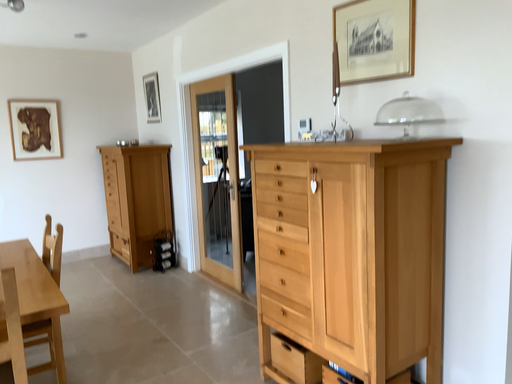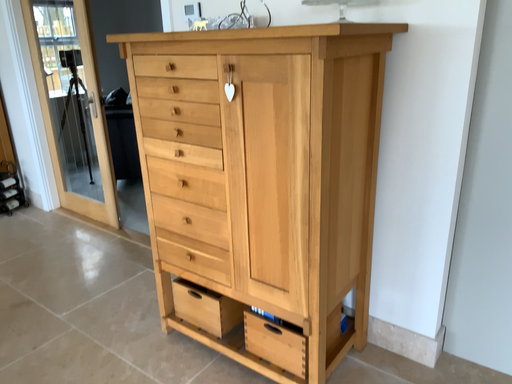
Question: Which way did the camera rotate in the video?

Choices:
 (A) rotated right
 (B) rotated left

Answer: (A)